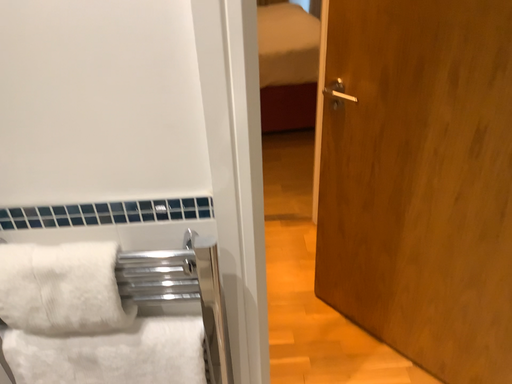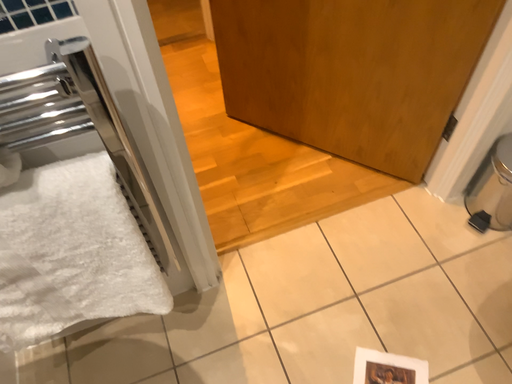
Question: Which way did the camera rotate in the video?

Choices:
 (A) rotated right
 (B) rotated left

Answer: (A)